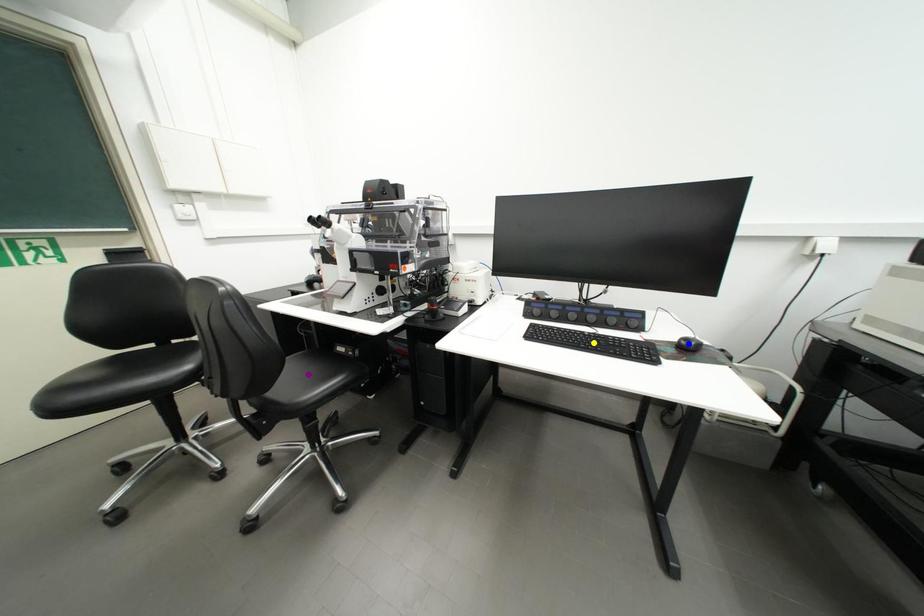
Order these from nearest to farthest:
1. blue point
2. purple point
3. yellow point

purple point, yellow point, blue point